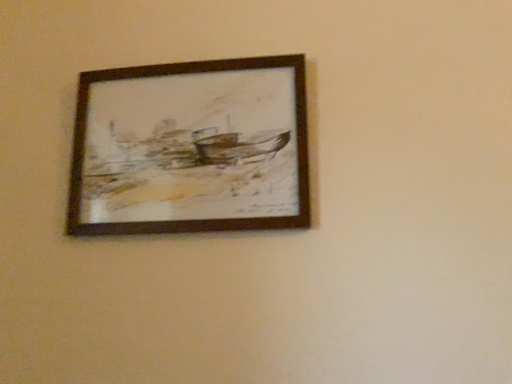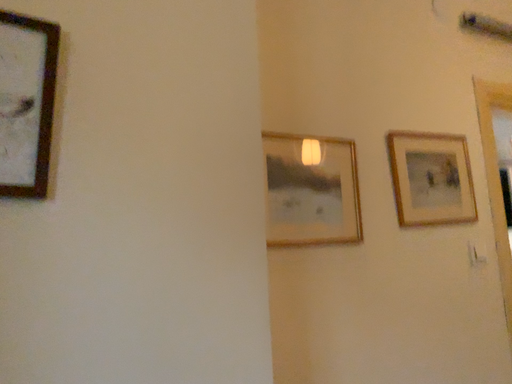
Question: Which way did the camera rotate in the video?

Choices:
 (A) rotated right
 (B) rotated left

Answer: (A)